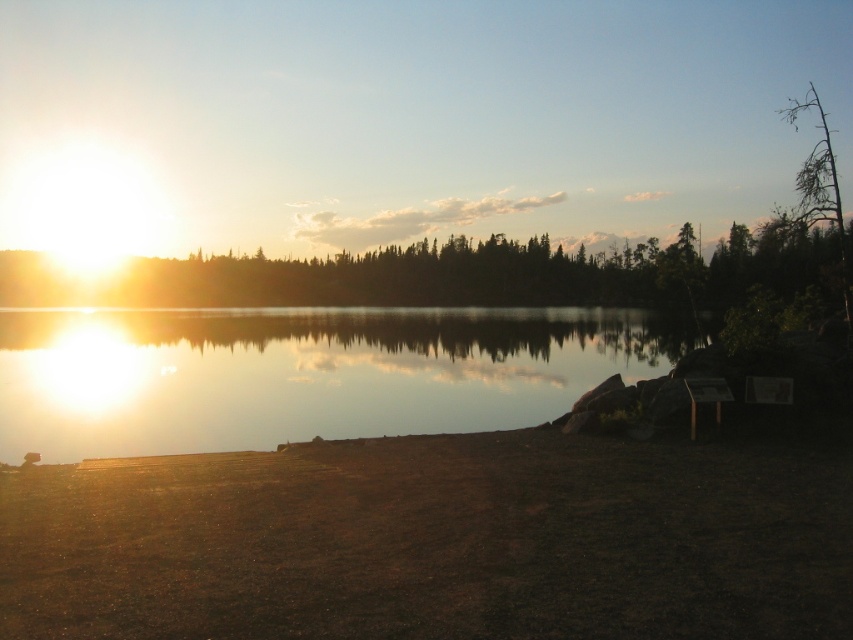
Which of these two, glistening water at center or green leafy tree at upper center, stands taller?

With more height is green leafy tree at upper center.

Is glistening water at center taller than green leafy tree at upper center?

No, glistening water at center is not taller than green leafy tree at upper center.

Which is behind, point (86, 332) or point (300, 275)?

Point (300, 275)

I want to click on glistening water at center, so click(x=303, y=372).